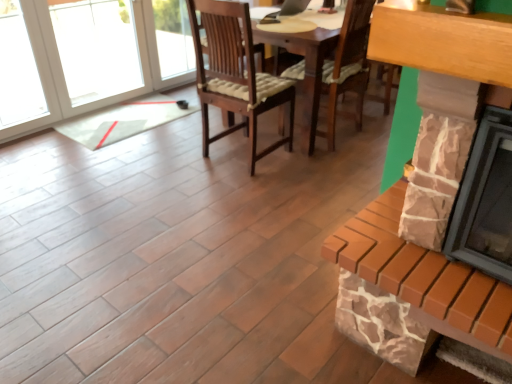
Question: Considering the relative sizes of brick fireplace at right, which is counted as the 1th fireplace, starting from the bottom, and stone fireplace at right, the second fireplace when ordered from bottom to top, in the image provided, is brick fireplace at right, which is counted as the 1th fireplace, starting from the bottom, taller than stone fireplace at right, the second fireplace when ordered from bottom to top,?

Choices:
 (A) no
 (B) yes

Answer: (A)

Question: Is brick fireplace at right, which is counted as the 1th fireplace, starting from the bottom, positioned in front of stone fireplace at right, the second fireplace when ordered from bottom to top?

Choices:
 (A) yes
 (B) no

Answer: (B)

Question: Considering the relative sizes of brick fireplace at right, which is counted as the 1th fireplace, starting from the bottom, and stone fireplace at right, the 1th fireplace from the top, in the image provided, is brick fireplace at right, which is counted as the 1th fireplace, starting from the bottom, wider than stone fireplace at right, the 1th fireplace from the top,?

Choices:
 (A) no
 (B) yes

Answer: (B)

Question: From the image's perspective, is brick fireplace at right, which is counted as the 1th fireplace, starting from the bottom, on top of stone fireplace at right, the second fireplace when ordered from bottom to top?

Choices:
 (A) no
 (B) yes

Answer: (A)

Question: Is stone fireplace at right, the second fireplace when ordered from bottom to top, inside brick fireplace at right, which is counted as the 1th fireplace, starting from the bottom?

Choices:
 (A) no
 (B) yes

Answer: (A)

Question: From the image's perspective, would you say stone fireplace at right, the 1th fireplace from the top, is positioned over brick fireplace at right, the second fireplace viewed from the top?

Choices:
 (A) yes
 (B) no

Answer: (A)

Question: From the image's perspective, is stone fireplace at right, the 1th fireplace from the top, beneath brick fireplace at right, the second fireplace viewed from the top?

Choices:
 (A) no
 (B) yes

Answer: (A)

Question: From a real-world perspective, is stone fireplace at right, the second fireplace when ordered from bottom to top, located higher than brick fireplace at right, the second fireplace viewed from the top?

Choices:
 (A) yes
 (B) no

Answer: (A)

Question: Is stone fireplace at right, the 1th fireplace from the top, at the right side of brick fireplace at right, the second fireplace viewed from the top?

Choices:
 (A) no
 (B) yes

Answer: (B)

Question: Can you confirm if stone fireplace at right, the second fireplace when ordered from bottom to top, is wider than brick fireplace at right, which is counted as the 1th fireplace, starting from the bottom?

Choices:
 (A) yes
 (B) no

Answer: (B)

Question: Can you confirm if stone fireplace at right, the second fireplace when ordered from bottom to top, is shorter than brick fireplace at right, the second fireplace viewed from the top?

Choices:
 (A) yes
 (B) no

Answer: (B)

Question: Looking at their shapes, would you say stone fireplace at right, the 1th fireplace from the top, is wider or thinner than brick fireplace at right, which is counted as the 1th fireplace, starting from the bottom?

Choices:
 (A) wide
 (B) thin

Answer: (B)